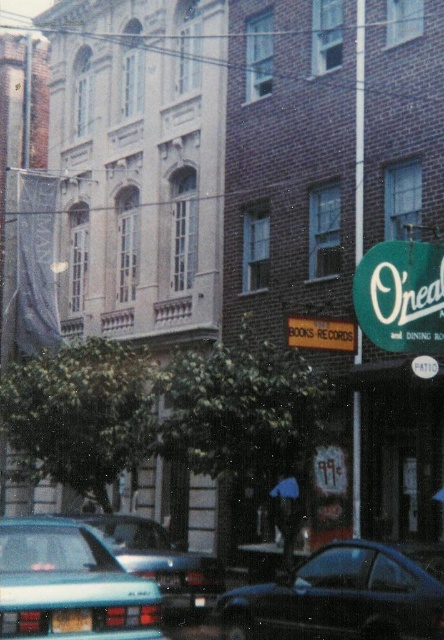
Question: Can you confirm if shiny black car at lower right is positioned below yellow plastic license plate at lower center?

Choices:
 (A) no
 (B) yes

Answer: (A)

Question: Among these objects, which one is farthest from the camera?

Choices:
 (A) yellow plastic license plate at lower center
 (B) matte black sign at center
 (C) shiny black car at lower right
 (D) matte black license plate at lower left

Answer: (B)

Question: Can you confirm if matte black sign at center is positioned below yellow plastic license plate at lower center?

Choices:
 (A) yes
 (B) no

Answer: (B)

Question: Which object is the farthest from the yellow plastic license plate at lower center?

Choices:
 (A) matte black sign at center
 (B) teal matte sedan at lower left
 (C) teal matte car at lower left

Answer: (B)

Question: Among these points, which one is nearest to the camera?

Choices:
 (A) (428, 307)
 (B) (52, 596)
 (C) (171, 572)
 (D) (165, 572)

Answer: (B)

Question: Is green fabric sign at lower right bigger than yellow plastic license plate at lower center?

Choices:
 (A) no
 (B) yes

Answer: (B)